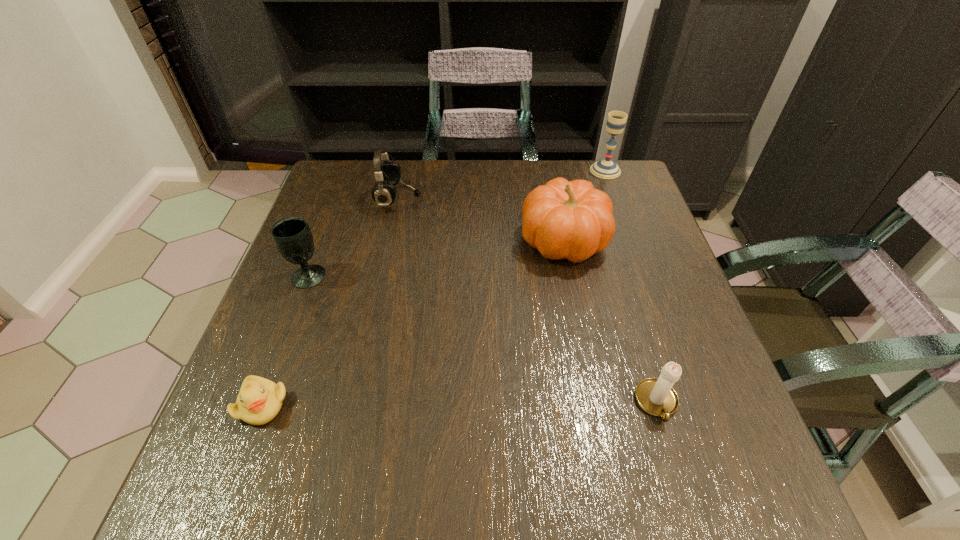
Where is `pumpkin located in the right edge section of the desktop`? The height and width of the screenshot is (540, 960). pumpkin located in the right edge section of the desktop is located at coordinates (572, 220).

Where is `candle holder that is at the right edge`? The height and width of the screenshot is (540, 960). candle holder that is at the right edge is located at coordinates (655, 396).

I want to click on object that is at the far left corner, so click(x=387, y=174).

Image resolution: width=960 pixels, height=540 pixels. Identify the location of object located in the far right corner section of the desktop. (607, 169).

You are a GUI agent. You are given a task and a screenshot of the screen. Output one action in this format:
    pyautogui.click(x=<x>, y=<y>)
    Task: Click on the free space at the far edge of the desktop
    
    Given the screenshot: What is the action you would take?
    pyautogui.click(x=518, y=198)

This screenshot has height=540, width=960. Find the location of `blank space at the near edge`. blank space at the near edge is located at coordinates (445, 492).

At what (x,y) coordinates should I click in order to perform the action: click on free space at the left edge of the desktop. Please return your answer as a coordinate pair (x, y). Looking at the image, I should click on (359, 220).

Image resolution: width=960 pixels, height=540 pixels. Find the location of `vacant space at the right edge`. vacant space at the right edge is located at coordinates (642, 312).

Find the location of a particular element. free location at the far right corner is located at coordinates (623, 167).

Image resolution: width=960 pixels, height=540 pixels. I want to click on vacant space at the near right corner of the desktop, so click(757, 511).